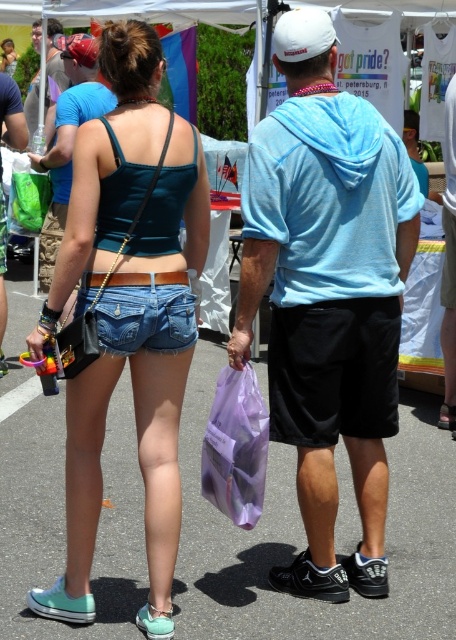
You are standing in the center of the scene. There is a point at coordinates point (72, 113). What object is located at that point?

The matte blue hoodie at upper center is located at point 0.167, 0.160.